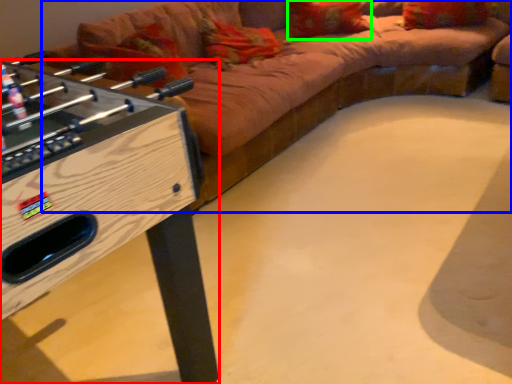
Question: Estimate the real-world distances between objects in this image. Which object is closer to furniture (highlighted by a red box), studio couch (highlighted by a blue box) or pillow (highlighted by a green box)?

Choices:
 (A) studio couch
 (B) pillow

Answer: (A)